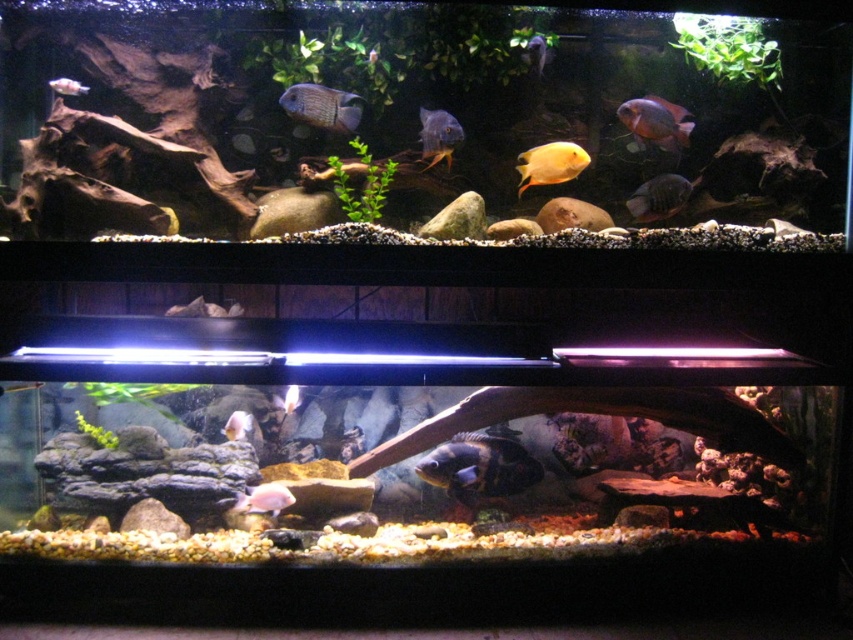
Between point (641, 192) and point (235, 435), which one is positioned in front?

Point (641, 192)

Who is more distant from viewer, (642, 208) or (244, 432)?

The point (244, 432) is behind.

Locate an element on the screen. Image resolution: width=853 pixels, height=640 pixels. matte black fish at center is located at coordinates (659, 196).

Who is lower down, matte blue fish at upper center or matte orange fish at upper center?

matte orange fish at upper center is below.

Who is positioned more to the left, matte blue fish at upper center or matte orange fish at upper center?

Positioned to the left is matte blue fish at upper center.

Which is in front, point (337, 108) or point (662, 108)?

Point (337, 108)

Locate an element on the screen. The height and width of the screenshot is (640, 853). matte blue fish at upper center is located at coordinates (322, 106).

Can you confirm if pink matte fish at center is positioned to the right of white matte fish at lower center?

No, pink matte fish at center is not to the right of white matte fish at lower center.

Can you confirm if pink matte fish at center is positioned to the left of white matte fish at lower center?

Correct, you'll find pink matte fish at center to the left of white matte fish at lower center.

At what (x,y) coordinates should I click in order to perform the action: click on pink matte fish at center. Please return your answer as a coordinate pair (x, y). The height and width of the screenshot is (640, 853). Looking at the image, I should click on (263, 499).

You are a GUI agent. You are given a task and a screenshot of the screen. Output one action in this format:
    pyautogui.click(x=<x>, y=<y>)
    Task: Click on the pink matte fish at center
    Image resolution: width=853 pixels, height=640 pixels.
    Given the screenshot: What is the action you would take?
    pyautogui.click(x=263, y=499)